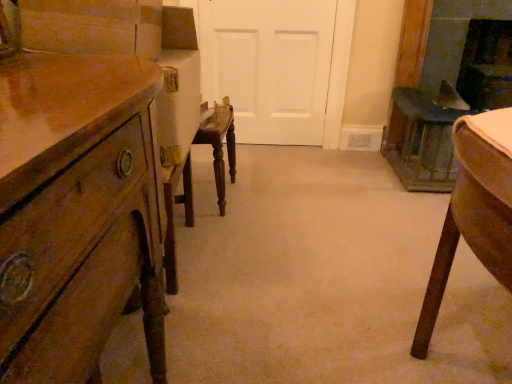
Question: From the image's perspective, is white matte door at center above or below wooden chest of drawers at left?

Choices:
 (A) above
 (B) below

Answer: (A)

Question: Is white matte door at center to the left or to the right of wooden chest of drawers at left in the image?

Choices:
 (A) left
 (B) right

Answer: (B)

Question: Which is nearer to the white matte door at center?

Choices:
 (A) dark gray stone fireplace at right, the first fireplace from the left
 (B) wooden chest of drawers at left
 (C) dark brown wood fireplace at upper right, the 2th fireplace viewed from the left

Answer: (A)

Question: Which object is the closest to the dark gray stone fireplace at right, the first fireplace from the left?

Choices:
 (A) white matte door at center
 (B) dark brown wood fireplace at upper right, the 2th fireplace viewed from the left
 (C) wooden chest of drawers at left

Answer: (B)